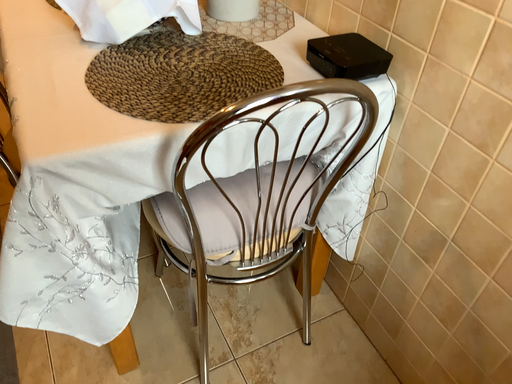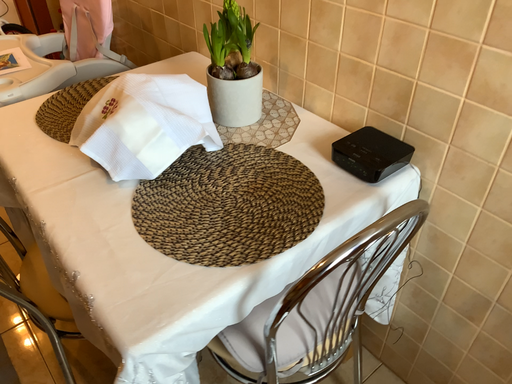
Question: Which way did the camera rotate in the video?

Choices:
 (A) rotated right
 (B) rotated left

Answer: (A)